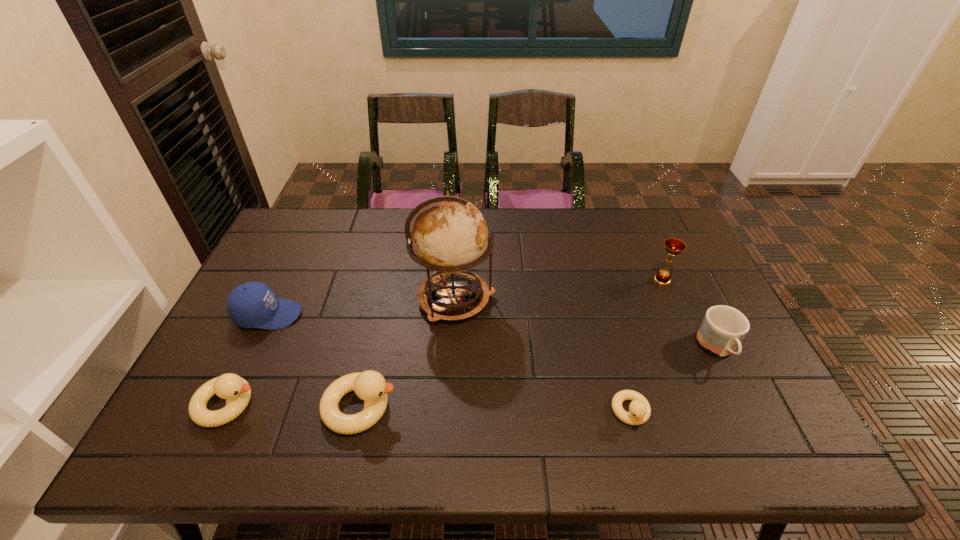
Please point a space for a new duckling to maintain equal intervals. Please provide its 2D coordinates. Your answer should be formatted as a tuple, i.e. [(x, y)], where the tuple contains the x and y coordinates of a point satisfying the conditions above.

[(494, 409)]